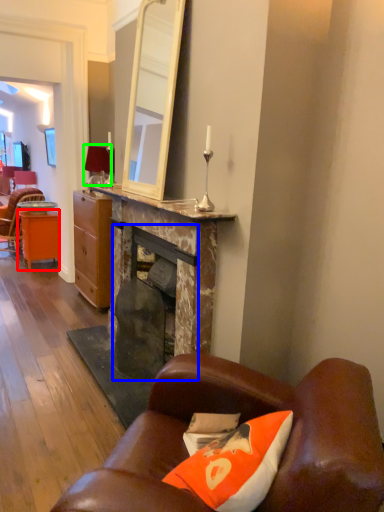
Question: Which object is positioned closest to desk (highlighted by a red box)? Select from fireplace (highlighted by a blue box) and lamp (highlighted by a green box).

Choices:
 (A) fireplace
 (B) lamp

Answer: (B)